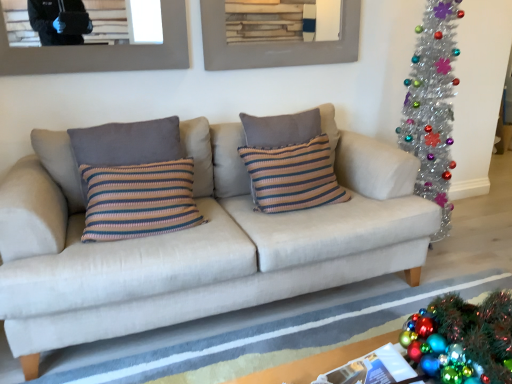
Question: Is point [x=156, y=127] positioned closer to the camera than point [x=0, y=28]?

Choices:
 (A) farther
 (B) closer

Answer: (A)

Question: Considering the positions of striped fabric pillow at left, the 2th pillow positioned from the right, and brushed metal picture frame at upper center, the first picture frame from the left, in the image, is striped fabric pillow at left, the 2th pillow positioned from the right, bigger or smaller than brushed metal picture frame at upper center, the first picture frame from the left,?

Choices:
 (A) small
 (B) big

Answer: (B)

Question: Estimate the real-world distances between objects in this image. Which object is farther from the beige fabric couch at center?

Choices:
 (A) white fabric rug at lower center
 (B) brushed metal picture frame at upper center, the first picture frame from the left
 (C) shiny metallic wreath at lower right
 (D) striped knit pillow at center, acting as the 2th pillow starting from the left
 (E) striped fabric pillow at left, marked as the 1th pillow in a left-to-right arrangement

Answer: (C)

Question: Estimate the real-world distances between objects in this image. Which object is closer to the brushed metal picture frame at upper center, the second picture frame from the right?

Choices:
 (A) white fabric rug at lower center
 (B) wooden frame at upper center, marked as the first picture frame in a right-to-left arrangement
 (C) striped fabric pillow at left, marked as the 1th pillow in a left-to-right arrangement
 (D) shiny metallic wreath at lower right
 (E) striped knit pillow at center, acting as the 2th pillow starting from the left

Answer: (C)